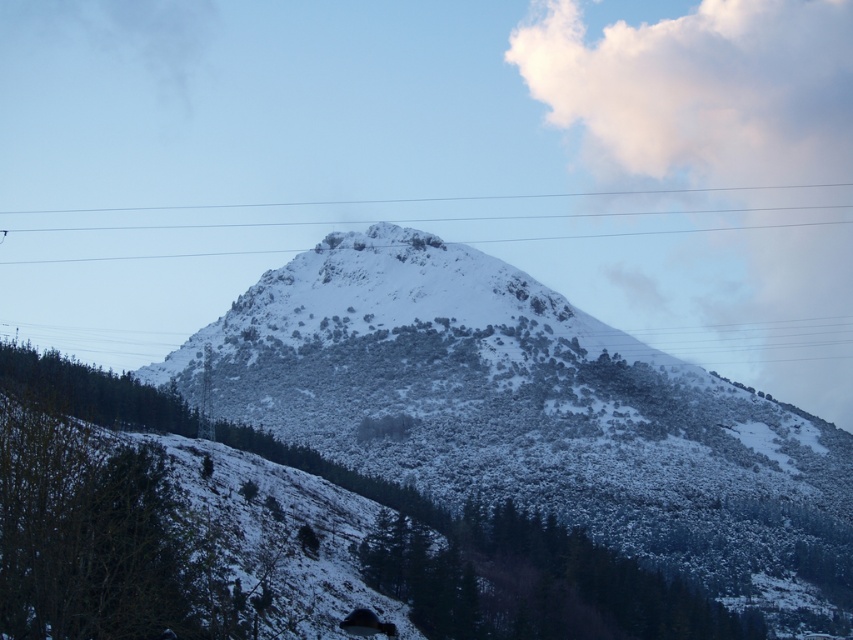
Does white snow-covered mountain at center have a greater width compared to white fluffy cloud at upper center?

Yes.

Is white snow-covered mountain at center above white fluffy cloud at upper center?

No.

Is point (387, 426) positioned after point (576, 36)?

No.

This screenshot has width=853, height=640. What are the coordinates of `white snow-covered mountain at center` in the screenshot? It's located at (534, 416).